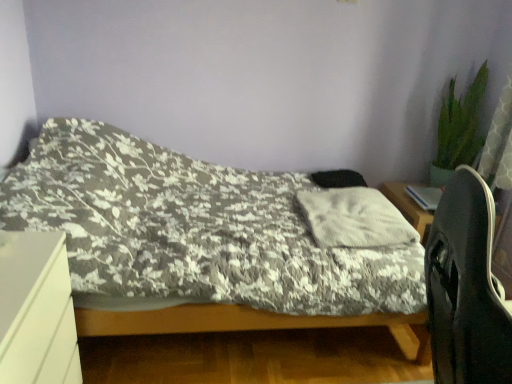
Question: Is black matte computer chair at right aimed at white matte desk at lower left?

Choices:
 (A) yes
 (B) no

Answer: (B)

Question: Does black matte computer chair at right have a larger size compared to white matte desk at lower left?

Choices:
 (A) no
 (B) yes

Answer: (B)

Question: Does black matte computer chair at right have a lesser width compared to white matte desk at lower left?

Choices:
 (A) yes
 (B) no

Answer: (B)

Question: Can you confirm if black matte computer chair at right is taller than white matte desk at lower left?

Choices:
 (A) no
 (B) yes

Answer: (B)

Question: Is black matte computer chair at right outside white matte desk at lower left?

Choices:
 (A) no
 (B) yes

Answer: (B)

Question: Is the depth of black matte computer chair at right less than that of white matte desk at lower left?

Choices:
 (A) no
 (B) yes

Answer: (B)

Question: Is white matte desk at lower left taller than black matte computer chair at right?

Choices:
 (A) no
 (B) yes

Answer: (A)

Question: Is black matte computer chair at right at the back of white matte desk at lower left?

Choices:
 (A) no
 (B) yes

Answer: (A)

Question: Is white matte desk at lower left aimed at black matte computer chair at right?

Choices:
 (A) no
 (B) yes

Answer: (B)

Question: From a real-world perspective, is white matte desk at lower left positioned under black matte computer chair at right based on gravity?

Choices:
 (A) yes
 (B) no

Answer: (A)

Question: Would you say white matte desk at lower left contains black matte computer chair at right?

Choices:
 (A) yes
 (B) no

Answer: (B)

Question: Considering the relative sizes of white matte desk at lower left and black matte computer chair at right in the image provided, is white matte desk at lower left shorter than black matte computer chair at right?

Choices:
 (A) yes
 (B) no

Answer: (A)

Question: From the image's perspective, is fluffy white pillow at center located beneath black matte computer chair at right?

Choices:
 (A) no
 (B) yes

Answer: (A)